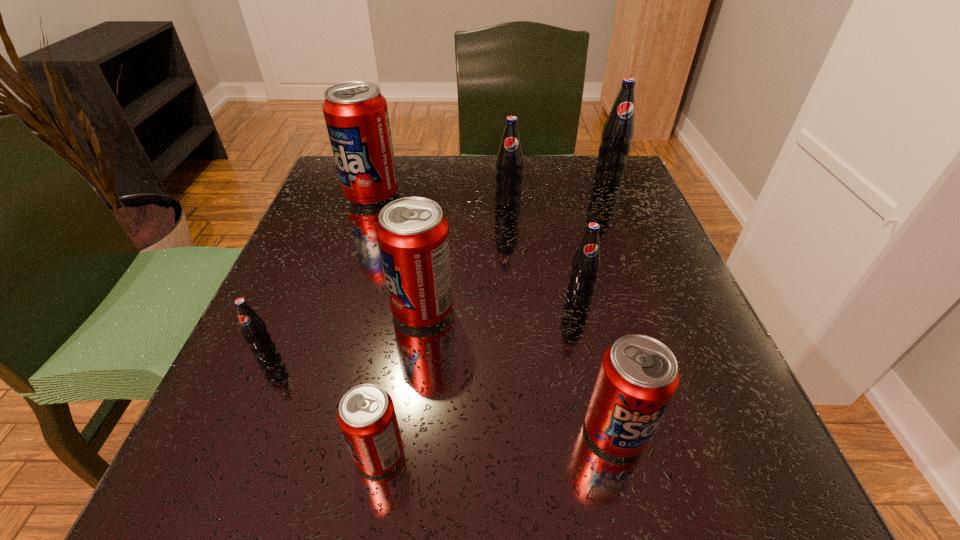
What are the coordinates of `the fifth closest soda can relative to the second smallest red soda can` in the screenshot? It's located at (509, 164).

Point out which black pop is positioned as the nearest to the third black pop from right to left. Please provide its 2D coordinates. Your answer should be formatted as a tuple, i.e. [(x, y)], where the tuple contains the x and y coordinates of a point satisfying the conditions above.

[(618, 132)]

I want to click on the closest black pop to the rightmost black pop, so click(509, 164).

Identify the location of red soda can that is the second closest one to the leftmost object. (366, 415).

The width and height of the screenshot is (960, 540). What are the coordinates of `the closest red soda can to the rightmost red soda can` in the screenshot? It's located at pyautogui.click(x=413, y=233).

Locate an element on the screen. vacant space that satisfies the following two spatial constraints: 1. on the front label of the fourth object from right to left; 2. on the left side of the third biggest red soda can is located at coordinates (527, 431).

Locate an element on the screen. This screenshot has width=960, height=540. free point that satisfies the following two spatial constraints: 1. on the front label of the second smallest red soda can; 2. on the right side of the fifth object from left to right is located at coordinates (527, 431).

Locate an element on the screen. vacant area in the image that satisfies the following two spatial constraints: 1. on the front side of the second smallest red soda can; 2. on the right side of the second object from left to right is located at coordinates (294, 431).